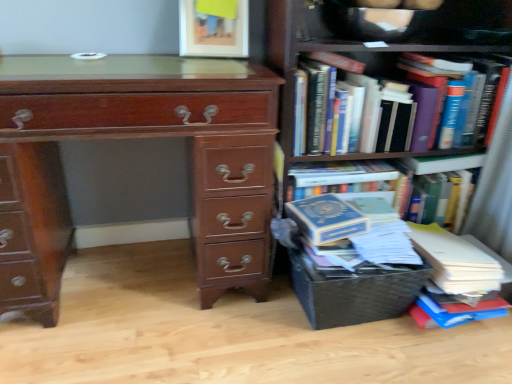
Question: From a real-world perspective, is shiny brown wooden chest of drawers at left located beneath blue hardcover book at right, positioned as the second book in top-to-bottom order?

Choices:
 (A) no
 (B) yes

Answer: (A)

Question: Can you confirm if shiny brown wooden chest of drawers at left is bigger than blue hardcover book at right, positioned as the 1th book in bottom-to-top order?

Choices:
 (A) no
 (B) yes

Answer: (B)

Question: From the image's perspective, is shiny brown wooden chest of drawers at left beneath blue hardcover book at right, positioned as the second book in top-to-bottom order?

Choices:
 (A) no
 (B) yes

Answer: (A)

Question: From the image's perspective, is shiny brown wooden chest of drawers at left on top of blue hardcover book at right, positioned as the 1th book in bottom-to-top order?

Choices:
 (A) yes
 (B) no

Answer: (A)

Question: Considering the relative sizes of shiny brown wooden chest of drawers at left and blue hardcover book at right, positioned as the second book in top-to-bottom order, in the image provided, is shiny brown wooden chest of drawers at left smaller than blue hardcover book at right, positioned as the second book in top-to-bottom order,?

Choices:
 (A) yes
 (B) no

Answer: (B)

Question: Considering the positions of shiny brown wooden chest of drawers at left and hardcover books at right in the image, is shiny brown wooden chest of drawers at left bigger or smaller than hardcover books at right?

Choices:
 (A) big
 (B) small

Answer: (A)

Question: Looking at their shapes, would you say shiny brown wooden chest of drawers at left is wider or thinner than hardcover books at right?

Choices:
 (A) wide
 (B) thin

Answer: (A)

Question: From a real-world perspective, is shiny brown wooden chest of drawers at left physically located above or below hardcover books at right?

Choices:
 (A) below
 (B) above

Answer: (A)

Question: From the image's perspective, is shiny brown wooden chest of drawers at left located above or below hardcover books at right?

Choices:
 (A) above
 (B) below

Answer: (B)

Question: Is woven brown crate at lower right taller or shorter than hardcover books at right?

Choices:
 (A) short
 (B) tall

Answer: (A)

Question: Considering the positions of woven brown crate at lower right and hardcover books at right in the image, is woven brown crate at lower right wider or thinner than hardcover books at right?

Choices:
 (A) thin
 (B) wide

Answer: (A)

Question: From a real-world perspective, is woven brown crate at lower right above or below hardcover books at right?

Choices:
 (A) above
 (B) below

Answer: (B)

Question: From the image's perspective, is woven brown crate at lower right above or below hardcover books at right?

Choices:
 (A) above
 (B) below

Answer: (B)

Question: Choose the correct answer: Is hardcover books at upper right, which ranks as the second book in bottom-to-top order, inside woven brown crate at lower right or outside it?

Choices:
 (A) outside
 (B) inside

Answer: (A)

Question: From a real-world perspective, is hardcover books at upper right, which ranks as the second book in bottom-to-top order, positioned above or below woven brown crate at lower right?

Choices:
 (A) above
 (B) below

Answer: (A)